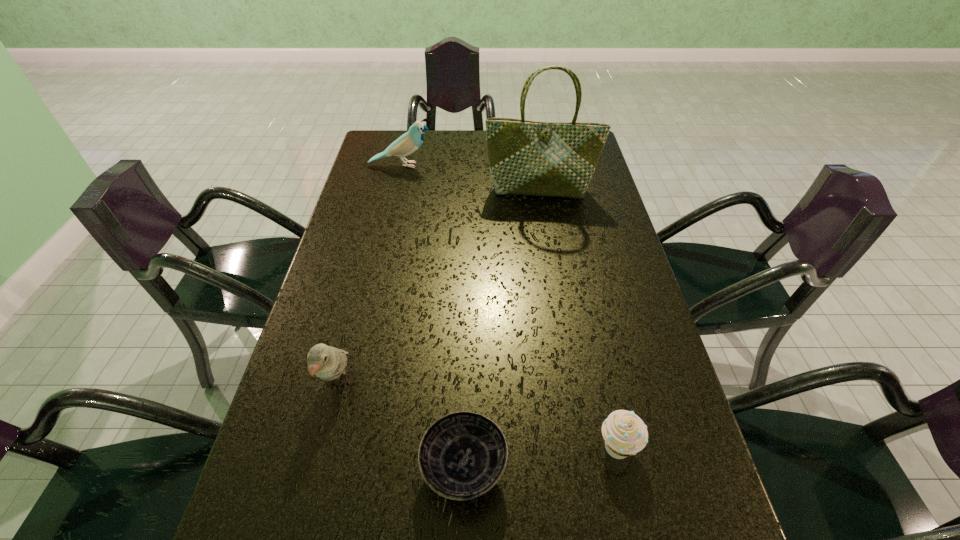
This screenshot has width=960, height=540. I want to click on vacant area between the farthest object and the muffin, so click(510, 306).

Locate an element on the screen. The image size is (960, 540). vacant area between the shopping bag and the farthest object is located at coordinates (470, 178).

This screenshot has height=540, width=960. I want to click on empty space between the shortest object and the muffin, so pos(540,458).

In order to click on free space between the third nearest object and the tallest object in this screenshot , I will do `click(440, 287)`.

In order to click on unoccupied position between the farther bird and the shopping bag in this screenshot , I will do `click(470, 178)`.

The width and height of the screenshot is (960, 540). Identify the location of free space between the muffin and the farther bird. (510, 306).

Locate an element on the screen. unoccupied position between the third nearest object and the shortest object is located at coordinates (401, 426).

Where is `empty space that is in between the farther bird and the muffin`? empty space that is in between the farther bird and the muffin is located at coordinates (510, 306).

Locate an element on the screen. vacant space that's between the fourth nearest object and the shortest object is located at coordinates (502, 329).

The height and width of the screenshot is (540, 960). Find the location of `object identified as the fourth closest to the muffin`. object identified as the fourth closest to the muffin is located at coordinates (409, 142).